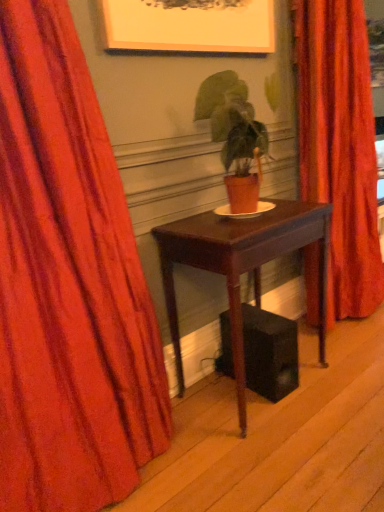
Question: From the image's perspective, is matte orange pot at center positioned above or below velvet orange curtain at center, which ranks as the 1th curtain in back-to-front order?

Choices:
 (A) below
 (B) above

Answer: (A)

Question: Based on their sizes in the image, would you say matte orange pot at center is bigger or smaller than velvet orange curtain at center, which ranks as the 1th curtain in back-to-front order?

Choices:
 (A) big
 (B) small

Answer: (B)

Question: Which of these objects is positioned farthest from the mahogany wood table at center?

Choices:
 (A) velvet orange curtain at center, which ranks as the first curtain in right-to-left order
 (B) matte orange pot at center
 (C) velvet red curtain at left, which ranks as the first curtain in front-to-back order

Answer: (A)

Question: Which object is the farthest from the mahogany wood table at center?

Choices:
 (A) velvet red curtain at left, which is counted as the second curtain, starting from the right
 (B) velvet orange curtain at center, which ranks as the first curtain in right-to-left order
 (C) matte orange pot at center

Answer: (B)